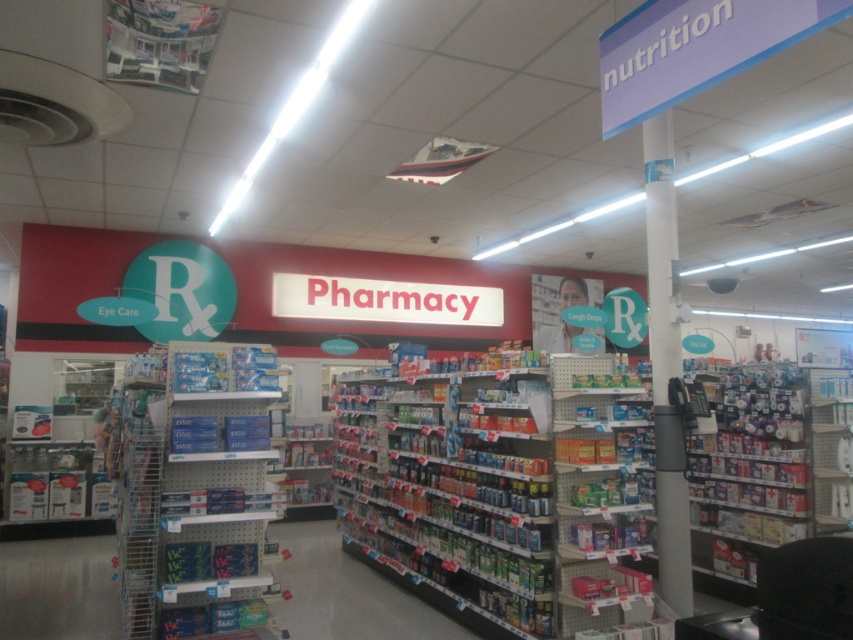
Does white glossy pillar at center-right have a lesser height compared to red plastic sign at center?

No.

Does point (670, 428) lie in front of point (277, 282)?

Yes, it is.

The image size is (853, 640). Find the location of `white glossy pillar at center-right`. white glossy pillar at center-right is located at coordinates (665, 365).